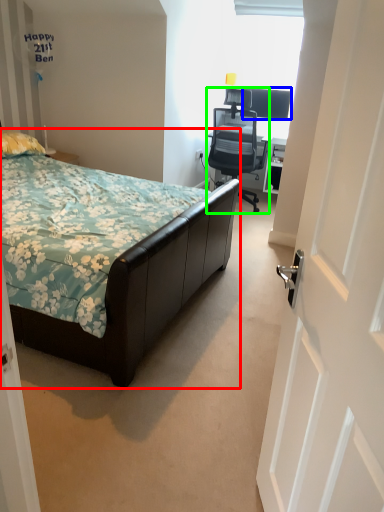
Question: Which is nearer to the bed (highlighted by a red box)? television (highlighted by a blue box) or chair (highlighted by a green box).

Choices:
 (A) television
 (B) chair

Answer: (B)